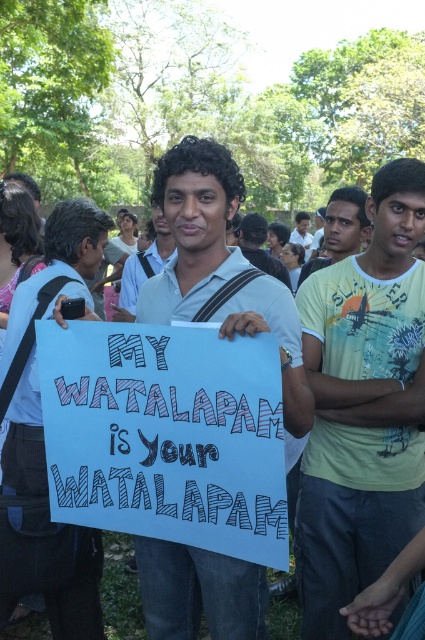
Question: Which of the following is the farthest from the observer?

Choices:
 (A) yellow printed t-shirt at right
 (B) black fabric shirt at center

Answer: (B)

Question: Where is white matte sign at center located in relation to white paper sign at left in the image?

Choices:
 (A) left
 (B) right

Answer: (B)

Question: Among these points, which one is nearest to the camera?

Choices:
 (A) (20, 285)
 (B) (323, 433)
 (C) (271, 323)

Answer: (C)

Question: Is white paper sign at left closer to camera compared to black fabric shirt at center?

Choices:
 (A) yes
 (B) no

Answer: (A)

Question: Which object is positioned farthest from the white matte sign at center?

Choices:
 (A) yellow printed t-shirt at right
 (B) white cotton shirt at center

Answer: (B)

Question: Is yellow printed t-shirt at right behind white matte sign at center?

Choices:
 (A) yes
 (B) no

Answer: (A)